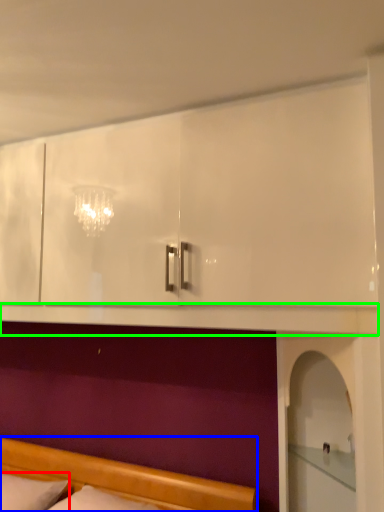
Question: Estimate the real-world distances between objects in this image. Which object is closer to pillow (highlighted by a red box), bed (highlighted by a blue box) or mantle (highlighted by a green box)?

Choices:
 (A) bed
 (B) mantle

Answer: (A)